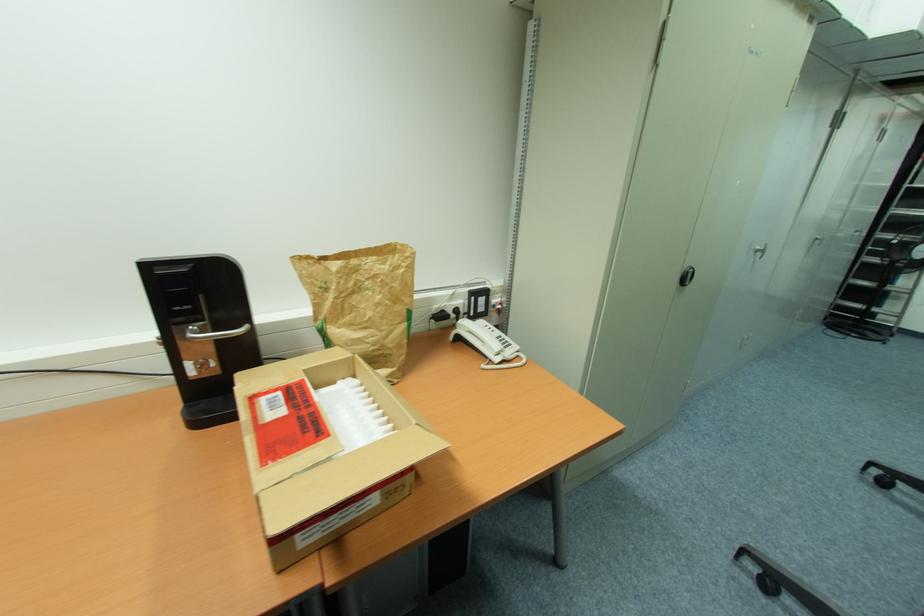
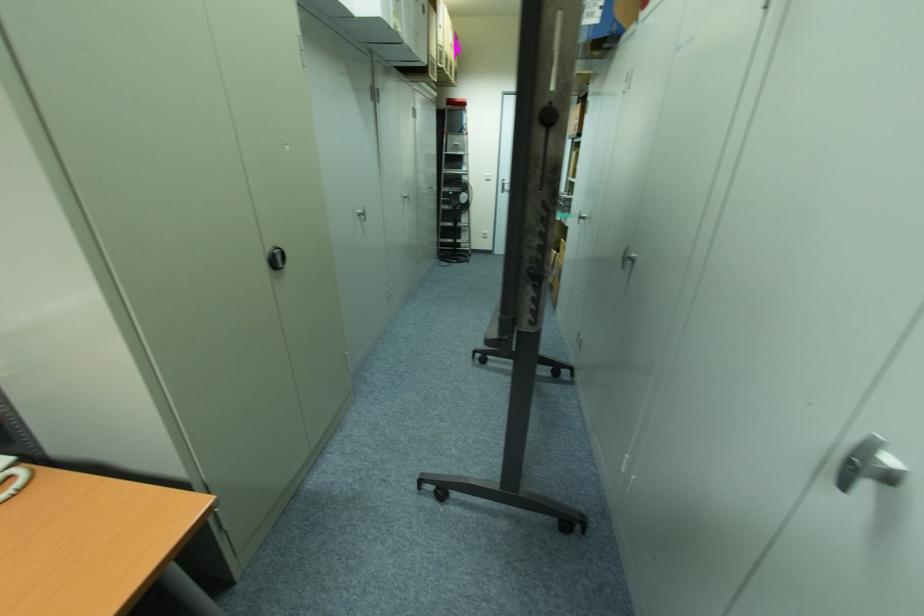
Locate, in the second image, the point that corresponds to the point at 758,252 in the first image.

(361, 215)